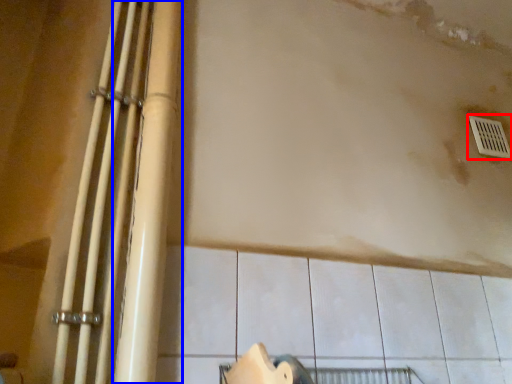
Question: Which point is closer to the camera, window (highlighted by a red box) or beam (highlighted by a blue box)?

Choices:
 (A) window
 (B) beam

Answer: (B)